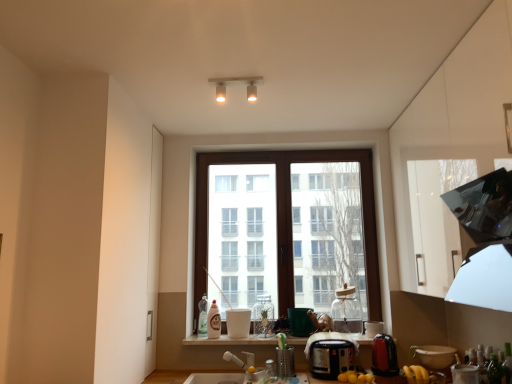
I want to click on vacant space underneath white glossy cup at center, marked as the sixth appliance in a right-to-left arrangement (from a real-world perspective), so click(x=238, y=338).